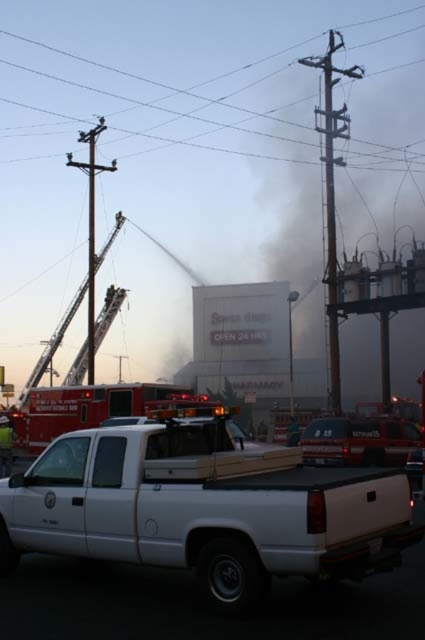
You are a firefighter arriving at the scene of a building fire. You see a point marked at coordinates [76,404]. What object is located at this point?

The point at coordinates [76,404] marks the reddish orange metallic fire truck at left.